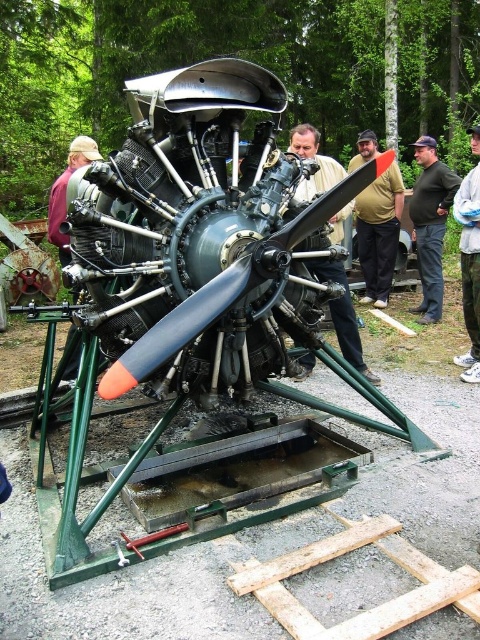
You are a photographer trying to capture the vintage radial engine on the green metal stand. You notice a fat man at center and dark green pants at center in the scene. Which object is closer to you, the photographer?

The fat man at center is closer to you than the dark green pants at center because the dark green pants at center is behind the fat man at center.

You are a photographer taking a picture of the vintage radial engine. You notice two points marked in the scene. The first point is at coordinate point (392,205) and the second is at point (410,308). From your current position, which point is closer to you?

Point (392,205) is further to the camera than point (410,308). Therefore, the point closer to you is point (410,308).